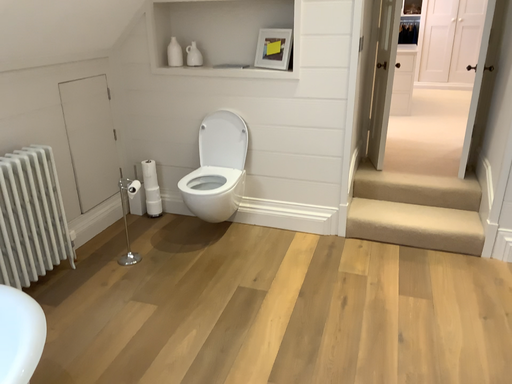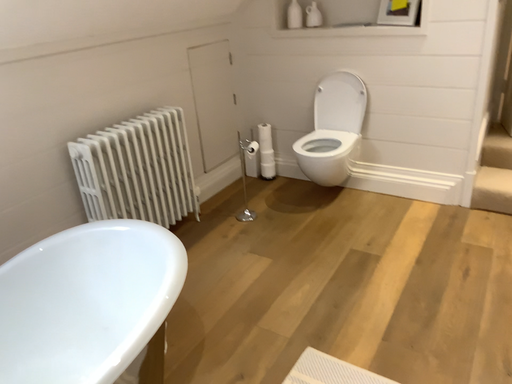
Question: How did the camera likely rotate when shooting the video?

Choices:
 (A) rotated right
 (B) rotated left

Answer: (B)